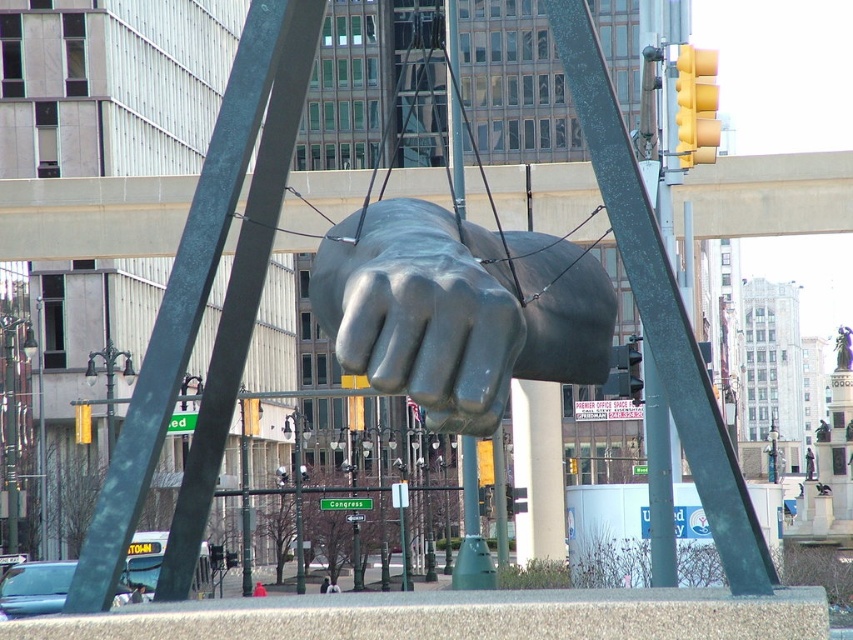
You are an art critic standing in the city square. You observe the polished bronze fist at center and the glossy metal fist at center. Which one is located to the right?

The polished bronze fist at center is positioned to the right of the glossy metal fist at center, so the polished bronze fist at center is the one located to the right.

You are a city planner reviewing the urban sculpture installation. You notice two green poles in the scene. Which pole, the green matte pole at left or the green patina pole at center, is taller?

The green patina pole at center is taller than the green matte pole at left.

You are a city planner reviewing a design for a new public art installation. The design includes the polished bronze fist at center and the green matte pole at left. Based on the provided image, which object is located to the right of the other?

The polished bronze fist at center is positioned on the right side of the green matte pole at left.